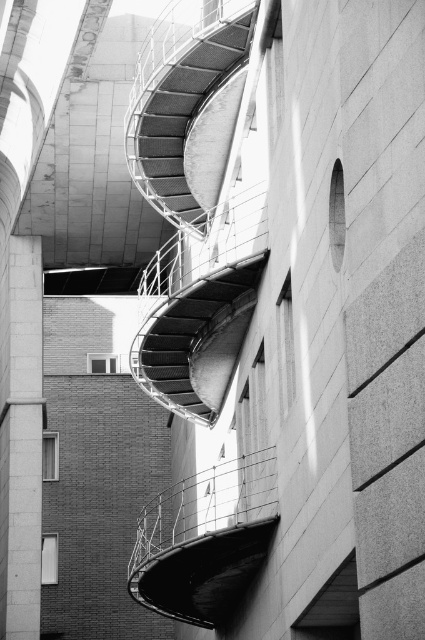
Measure the distance between metallic wire balustrade at center and camera.

metallic wire balustrade at center is 59.54 meters from camera.

Is metallic wire balustrade at center shorter than metallic mesh staircase at upper center?

Incorrect, metallic wire balustrade at center's height does not fall short of metallic mesh staircase at upper center's.

Locate an element on the screen. Image resolution: width=425 pixels, height=640 pixels. metallic wire balustrade at center is located at coordinates (204, 540).

Image resolution: width=425 pixels, height=640 pixels. In order to click on metallic mesh staircase at center in this screenshot , I will do `click(181, 96)`.

Is metallic mesh staircase at center to the right of metallic mesh staircase at upper center from the viewer's perspective?

In fact, metallic mesh staircase at center is to the left of metallic mesh staircase at upper center.

Is point (155, 93) behind point (181, 314)?

That is True.

Locate an element on the screen. This screenshot has height=640, width=425. metallic mesh staircase at center is located at coordinates (181, 96).

Can you confirm if metallic wire balustrade at center is smaller than metallic mesh staircase at center?

Incorrect, metallic wire balustrade at center is not smaller in size than metallic mesh staircase at center.

Locate an element on the screen. The image size is (425, 640). metallic wire balustrade at center is located at coordinates (204, 540).